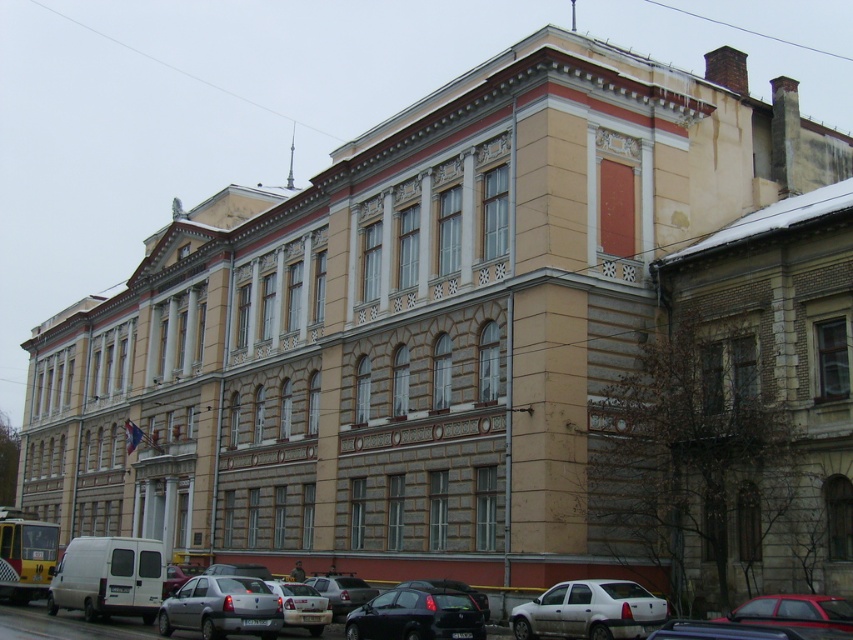
Question: Which of the following is the farthest from the observer?

Choices:
 (A) silver metallic sedan at center
 (B) silver metallic sedan at lower center

Answer: (A)

Question: Does white matte sedan at lower right appear on the right side of shiny red car at lower right?

Choices:
 (A) no
 (B) yes

Answer: (A)

Question: Which point appears closest to the camera in this image?

Choices:
 (A) (640, 611)
 (B) (369, 588)
 (C) (323, 611)

Answer: (A)

Question: Is white matte sedan at lower right below shiny black car at lower center?

Choices:
 (A) yes
 (B) no

Answer: (B)

Question: Which of these objects is positioned farthest from the silver metallic sedan at center?

Choices:
 (A) white matte sedan at lower right
 (B) shiny black car at lower center

Answer: (A)

Question: Does silver metallic hatchback at lower center have a smaller size compared to silver metallic sedan at center?

Choices:
 (A) yes
 (B) no

Answer: (B)